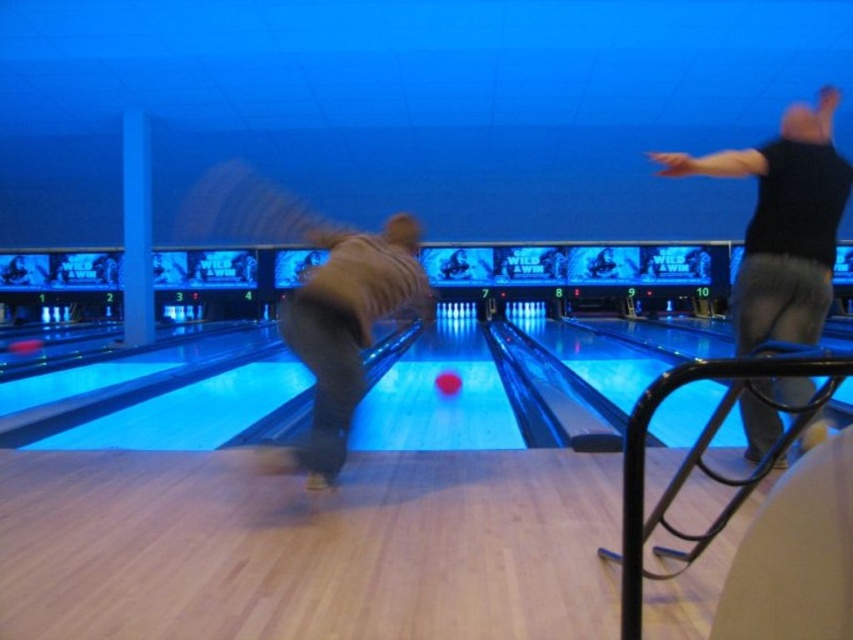
You are a photographer trying to capture the exact spot where the black matte shirt at upper right was positioned in the image. According to the coordinates provided, where should you aim your camera to replicate the same shot?

The black matte shirt at upper right was positioned at coordinates point [782,224], so you should aim your camera at that exact point to replicate the same shot.

You are a photographer trying to capture the scene of the black matte shirt at upper right and the brown suede jacket at center. Which piece of clothing is located more to the right side?

The black matte shirt at upper right is positioned on the right side of the brown suede jacket at center, so the black matte shirt at upper right is more to the right.

You are standing at the starting position on the bowling lane and see two points marked on the lane. The first point is at coordinate point (844, 180) and the second point is at coordinate point (440, 376). If you want to roll the ball towards the second point, will you pass the first point before reaching the second point?

Point (844, 180) is in front of point (440, 376), so yes, you will pass the first point before reaching the second point.